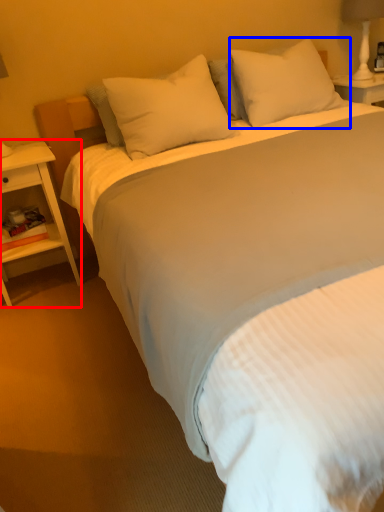
Question: Among these objects, which one is nearest to the camera, nightstand (highlighted by a red box) or pillow (highlighted by a blue box)?

Choices:
 (A) nightstand
 (B) pillow

Answer: (A)